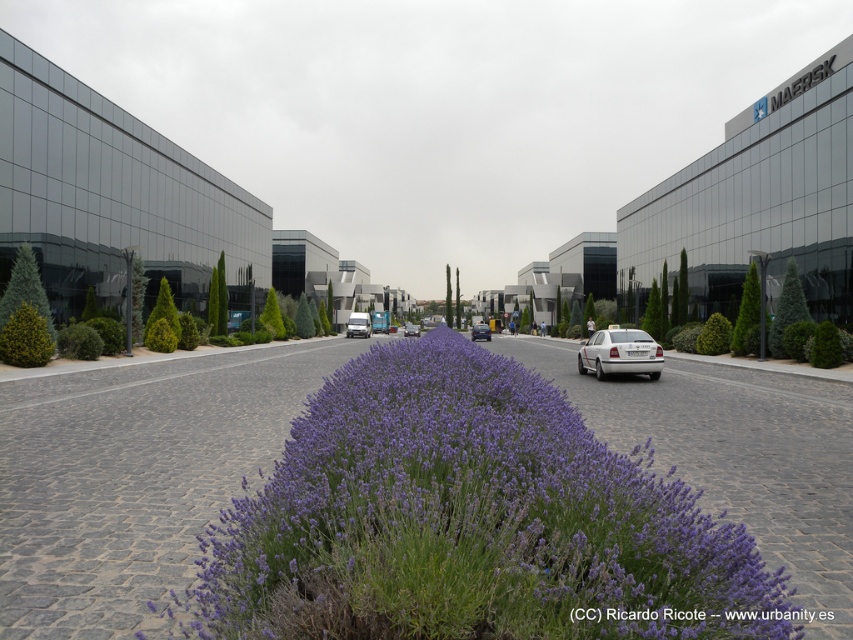
In the scene shown: You are a pedestrian standing at the edge of the road. You see a white glossy sedan at center and a metallic silver van at center. Which vehicle is closer to you?

The white glossy sedan at center is closer to you since it is positioned in front of the metallic silver van at center.

You are driving a delivery truck that needs to pass through the road in the image. There is a white matte sedan at center and a metallic silver van at center. Which vehicle should you move around to stay in your lane?

You should move around the metallic silver van at center because the white matte sedan at center is positioned to its right, so staying in your lane would require passing the van on the left side.

You are standing at the point marked as point [480,332]. What object is located exactly at this point?

The white glossy sedan at center is located exactly at point [480,332].